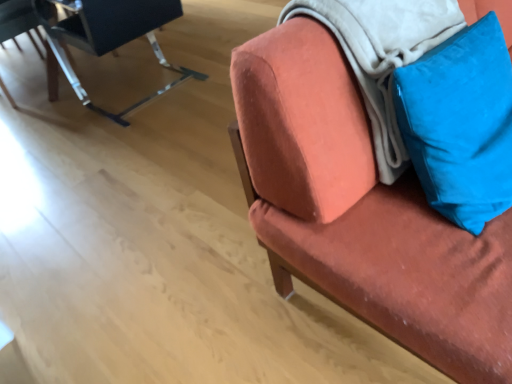
Question: Is metallic black chair at upper left, which appears as the second chair when viewed from the right, to the left of soft white blanket at upper right from the viewer's perspective?

Choices:
 (A) yes
 (B) no

Answer: (A)

Question: Is metallic black chair at upper left, the second chair from the left, next to soft white blanket at upper right and touching it?

Choices:
 (A) yes
 (B) no

Answer: (B)

Question: Considering the relative sizes of metallic black chair at upper left, the second chair from the left, and soft white blanket at upper right in the image provided, is metallic black chair at upper left, the second chair from the left, smaller than soft white blanket at upper right?

Choices:
 (A) no
 (B) yes

Answer: (A)

Question: From a real-world perspective, is metallic black chair at upper left, the second chair from the left, physically above soft white blanket at upper right?

Choices:
 (A) no
 (B) yes

Answer: (A)

Question: Is metallic black chair at upper left, the second chair from the left, oriented towards soft white blanket at upper right?

Choices:
 (A) yes
 (B) no

Answer: (B)

Question: Visually, is metallic black chair at upper left, the 3th chair positioned from the right, positioned to the left or to the right of blue velvet pillow at upper right?

Choices:
 (A) left
 (B) right

Answer: (A)

Question: In the image, is metallic black chair at upper left, marked as the 1th chair in a left-to-right arrangement, positioned in front of or behind blue velvet pillow at upper right?

Choices:
 (A) front
 (B) behind

Answer: (B)

Question: Looking at their shapes, would you say metallic black chair at upper left, marked as the 1th chair in a left-to-right arrangement, is wider or thinner than blue velvet pillow at upper right?

Choices:
 (A) wide
 (B) thin

Answer: (A)

Question: Considering the positions of metallic black chair at upper left, the 3th chair positioned from the right, and blue velvet pillow at upper right in the image, is metallic black chair at upper left, the 3th chair positioned from the right, taller or shorter than blue velvet pillow at upper right?

Choices:
 (A) tall
 (B) short

Answer: (A)

Question: In terms of height, does blue velvet pillow at upper right look taller or shorter compared to metallic black chair at upper left, marked as the 1th chair in a left-to-right arrangement?

Choices:
 (A) tall
 (B) short

Answer: (B)

Question: In terms of width, does blue velvet pillow at upper right look wider or thinner when compared to metallic black chair at upper left, marked as the 1th chair in a left-to-right arrangement?

Choices:
 (A) wide
 (B) thin

Answer: (B)

Question: From the image's perspective, is blue velvet pillow at upper right above or below metallic black chair at upper left, the 3th chair positioned from the right?

Choices:
 (A) below
 (B) above

Answer: (A)

Question: From a real-world perspective, is blue velvet pillow at upper right above or below metallic black chair at upper left, the 3th chair positioned from the right?

Choices:
 (A) below
 (B) above

Answer: (B)

Question: From the image's perspective, is velvet orange chair at upper right, which is the 3th chair in left-to-right order, positioned above or below metallic black chair at upper left, which appears as the second chair when viewed from the right?

Choices:
 (A) above
 (B) below

Answer: (B)

Question: From a real-world perspective, is velvet orange chair at upper right, which is the 3th chair in left-to-right order, physically located above or below metallic black chair at upper left, the second chair from the left?

Choices:
 (A) below
 (B) above

Answer: (B)